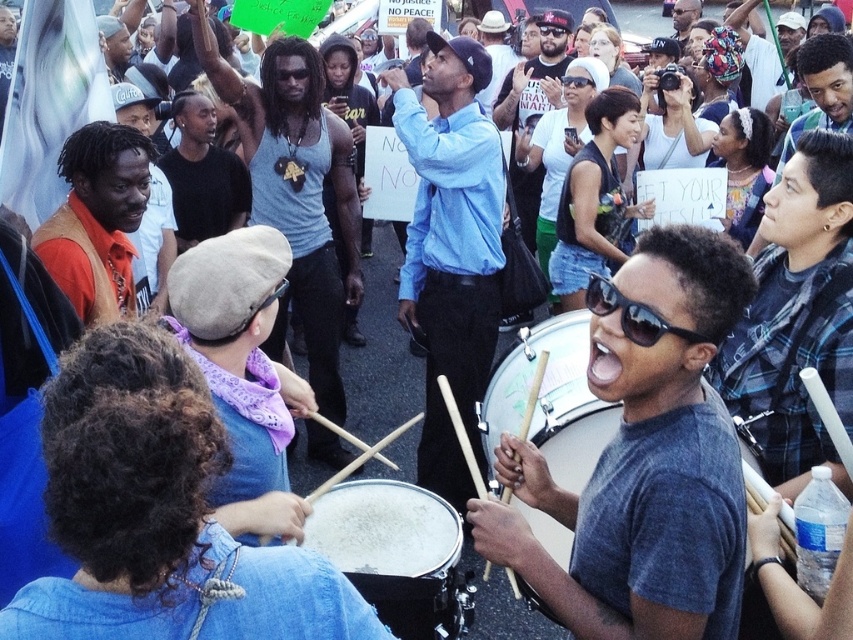
Between gray matte drum at center and smooth black drum at center, which one is positioned lower?

Positioned lower is smooth black drum at center.

Is point (682, 276) closer to camera compared to point (316, 531)?

Yes, it is.

Where is `gray matte drum at center`? The image size is (853, 640). gray matte drum at center is located at coordinates (643, 458).

Between gray matte drum at center and orange suede vest at left, which one is positioned higher?

orange suede vest at left is higher up.

Does point (495, 520) lie in front of point (86, 177)?

Yes, point (495, 520) is in front of point (86, 177).

The image size is (853, 640). Describe the element at coordinates (643, 458) in the screenshot. I see `gray matte drum at center` at that location.

This screenshot has height=640, width=853. I want to click on gray matte drum at center, so click(x=643, y=458).

Is the position of blue plaid shirt at right less distant than that of orange suede vest at left?

Yes.

Can you confirm if blue plaid shirt at right is bigger than orange suede vest at left?

Correct, blue plaid shirt at right is larger in size than orange suede vest at left.

At what (x,y) coordinates should I click in order to perform the action: click on blue plaid shirt at right. Please return your answer as a coordinate pair (x, y). The image size is (853, 640). Looking at the image, I should click on (796, 317).